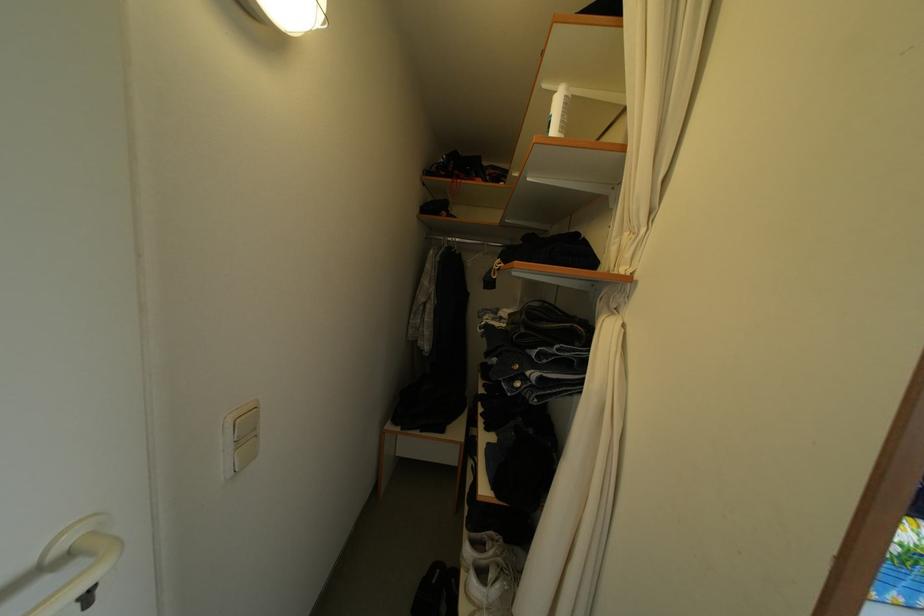
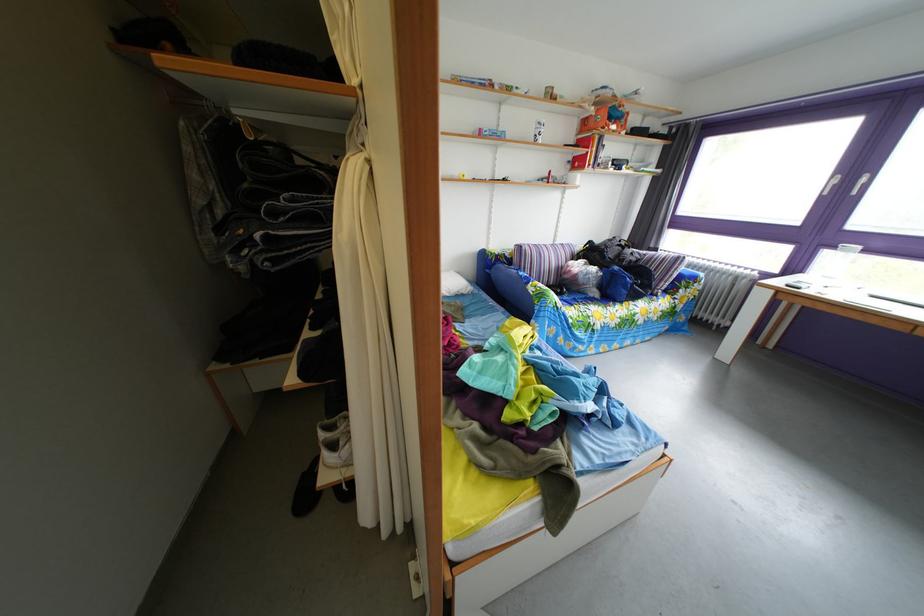
How did the camera likely rotate?

Result: The camera rotated toward right-down.